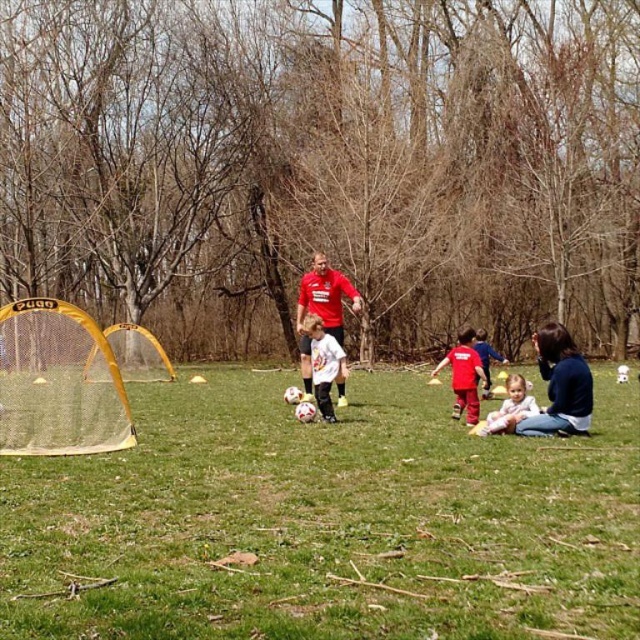
Consider the image. Is blue cotton shirt at lower right positioned in front of white matte soccer ball at center?

Yes.

Who is lower down, blue cotton shirt at lower right or white matte soccer ball at center?

blue cotton shirt at lower right is below.

Between point (572, 406) and point (326, 397), which one is positioned in front?

Point (572, 406) is more forward.

Locate an element on the screen. The image size is (640, 640). blue cotton shirt at lower right is located at coordinates (561, 385).

Can you confirm if blue cotton shirt at lower right is smaller than matte red shirt at center?

Correct, blue cotton shirt at lower right occupies less space than matte red shirt at center.

Does point (570, 380) come in front of point (353, 288)?

Yes, it is.

What are the coordinates of `blue cotton shirt at lower right` in the screenshot? It's located at (561, 385).

Can you confirm if green grass at center is positioned above white matte soccer ball at center?

No.

Can you confirm if green grass at center is taller than white matte soccer ball at center?

In fact, green grass at center may be shorter than white matte soccer ball at center.

Image resolution: width=640 pixels, height=640 pixels. What do you see at coordinates (326, 522) in the screenshot?
I see `green grass at center` at bounding box center [326, 522].

Where is `green grass at center`? This screenshot has height=640, width=640. green grass at center is located at coordinates (326, 522).